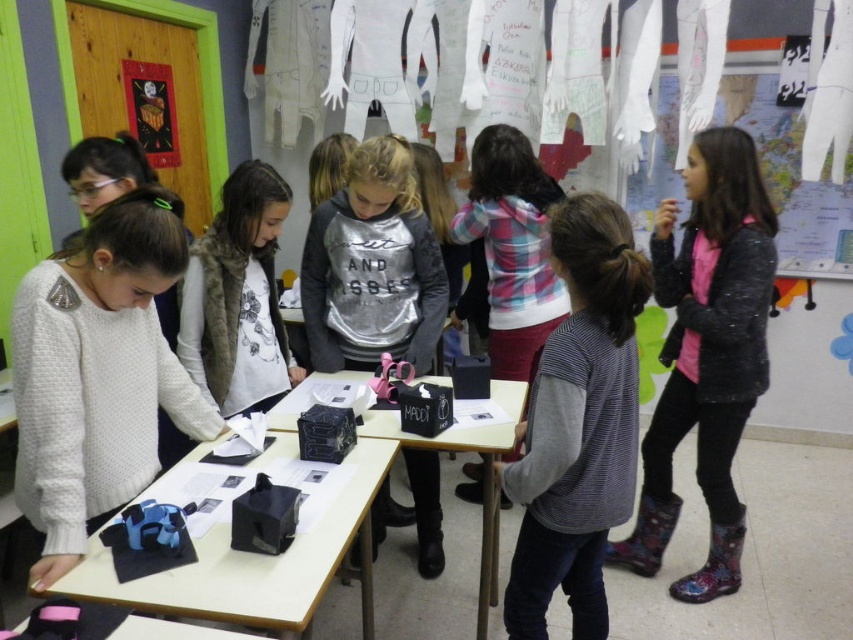
Question: Which object is farther from the camera taking this photo?

Choices:
 (A) black plastic table at center
 (B) white knitted sweater at center
 (C) fuzzy brown vest at center
 (D) black matte paper at center

Answer: (C)

Question: Is floral rubber boots at right to the left of silver metallic sweatshirt at center from the viewer's perspective?

Choices:
 (A) yes
 (B) no

Answer: (B)

Question: Can you confirm if striped sweater at center is smaller than floral rubber boots at right?

Choices:
 (A) no
 (B) yes

Answer: (B)

Question: Which of the following is the farthest from the observer?

Choices:
 (A) (436, 326)
 (B) (425, 440)
 (C) (257, 289)
 (D) (206, 552)

Answer: (A)

Question: Is fuzzy brown vest at center in front of black plastic table at center?

Choices:
 (A) yes
 (B) no

Answer: (B)

Question: Among these objects, which one is nearest to the camera?

Choices:
 (A) black plastic table at center
 (B) floral rubber boots at right
 (C) black matte paper at center

Answer: (C)